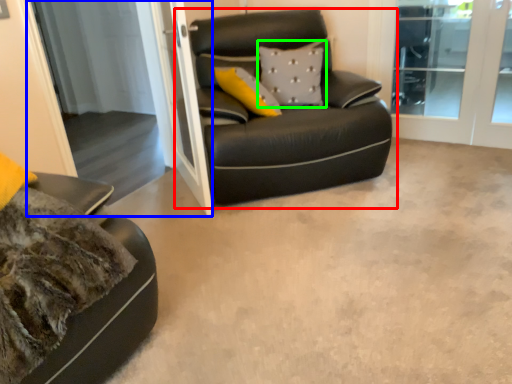
Question: Based on their relative distances, which object is nearer to studio couch (highlighted by a red box)? Choose from screen door (highlighted by a blue box) and pillow (highlighted by a green box).

Choices:
 (A) screen door
 (B) pillow

Answer: (B)